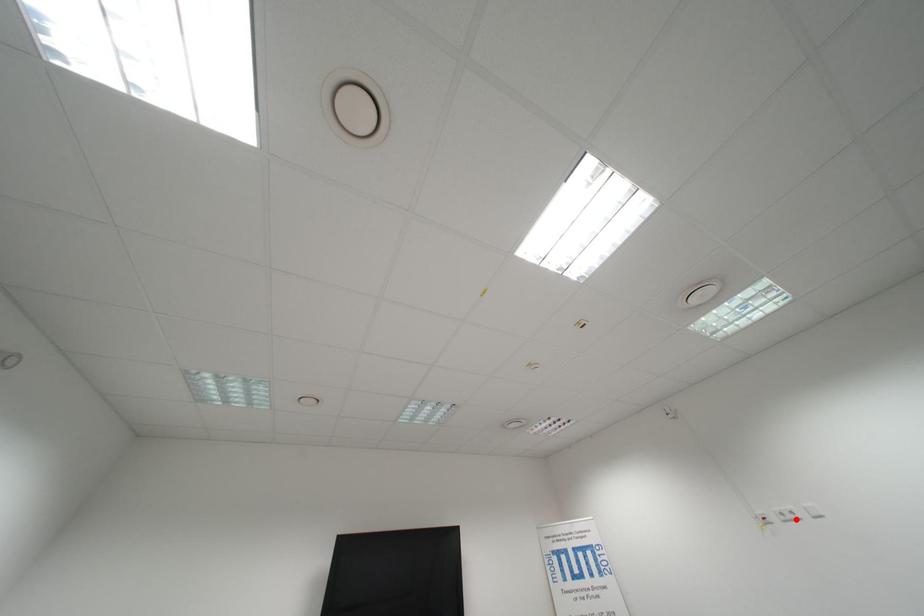
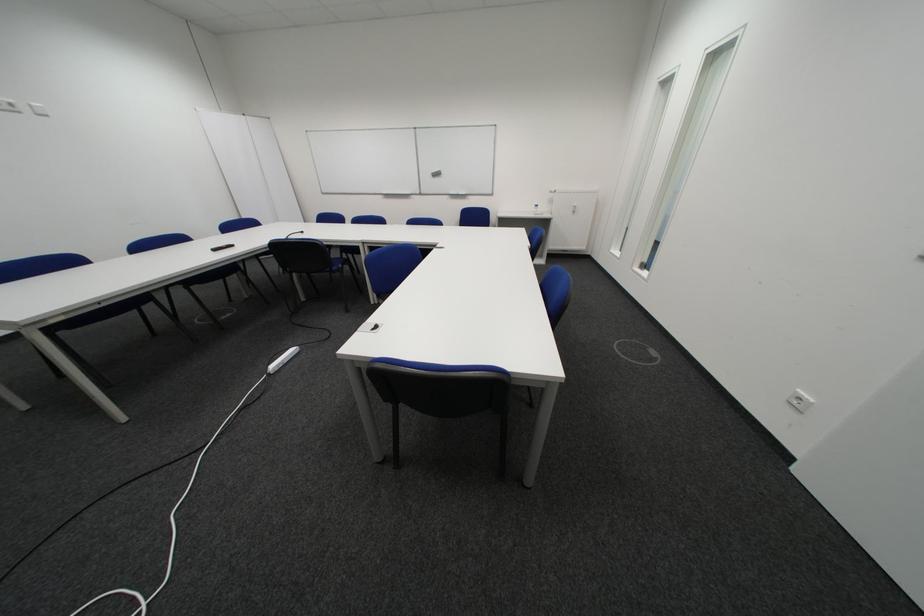
Question: I am providing you with two images of the same scene from different viewpoints. Given a red point in image1, look at the same physical point in image2. Is it:

Choices:
 (A) Closer to the viewpoint
 (B) Farther from the viewpoint

Answer: (B)